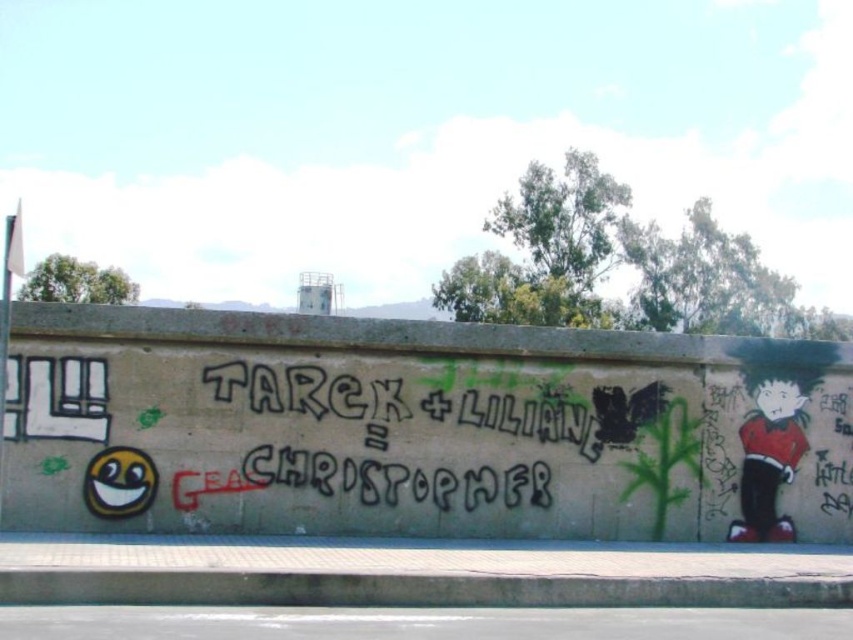
You are a graffiti artist planning to add a new sticker to the wall. You want to place it so that it covers part of the red glossy skateboarder at right but not the black spray paint graffiti at center. Is this possible?

Yes, since the black spray paint graffiti at center is in front of the red glossy skateboarder at right, you can place the sticker on the red glossy skateboarder at right without covering the black spray paint graffiti at center.

You are a street artist planning to add a new mural between the black spray paint graffiti at center and the red glossy skateboarder at right. Since you want the new mural to be taller than both existing pieces, which existing piece should you use as a reference for the minimum height required?

The black spray paint graffiti at center is shorter than the red glossy skateboarder at right, so you should use the red glossy skateboarder at right as the reference for the minimum height to ensure the new mural is taller than both.

What is the significance of the point at coordinates (398,408) in the graffiti scene?

The point at coordinates (398,408) marks the location of the black spray paint graffiti at center, which features the text TAREK and LILIANE.